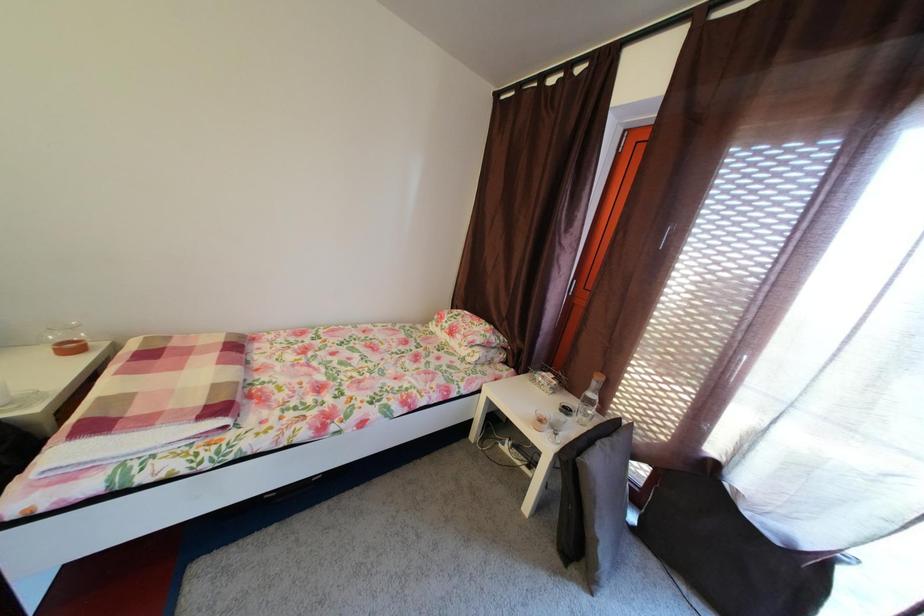
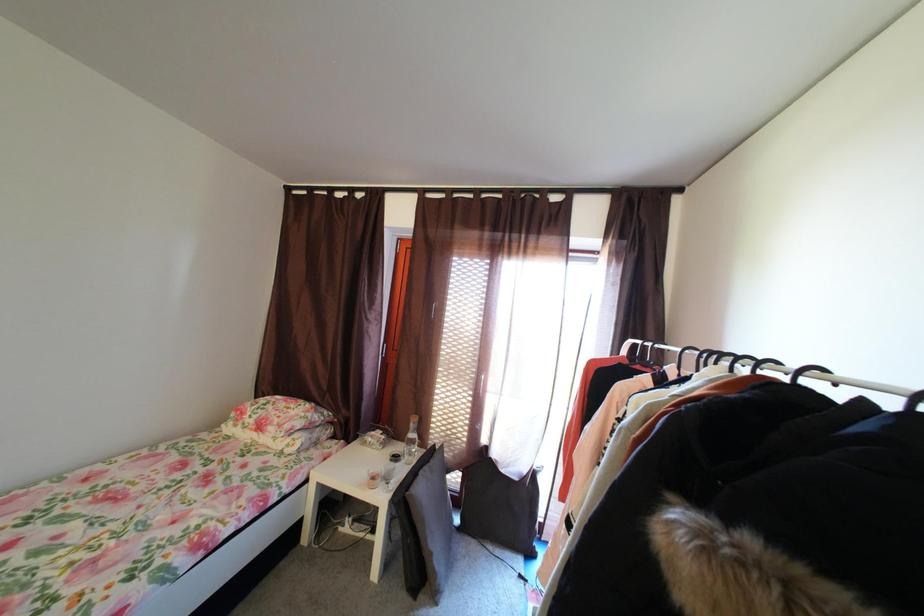
Question: The camera is either moving clockwise (left) or counter-clockwise (right) around the object. The first image is from the beginning of the video and the second image is from the end. Is the camera moving left or right when shooting the video?

Choices:
 (A) Left
 (B) Right

Answer: (A)